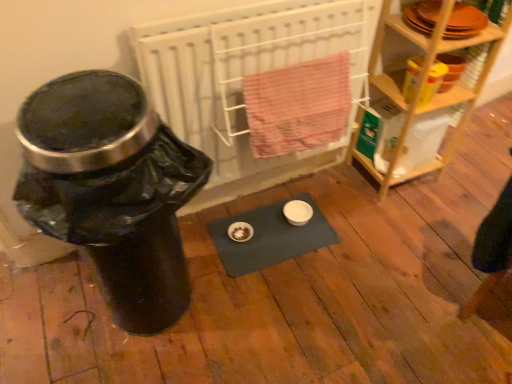
You are a GUI agent. You are given a task and a screenshot of the screen. Output one action in this format:
    pyautogui.click(x=<x>, y=<y>)
    Task: Click on the vacant area that is in front of blue fabric yoga mat at center
    Image resolution: width=512 pixels, height=384 pixels.
    Given the screenshot: What is the action you would take?
    pyautogui.click(x=271, y=307)